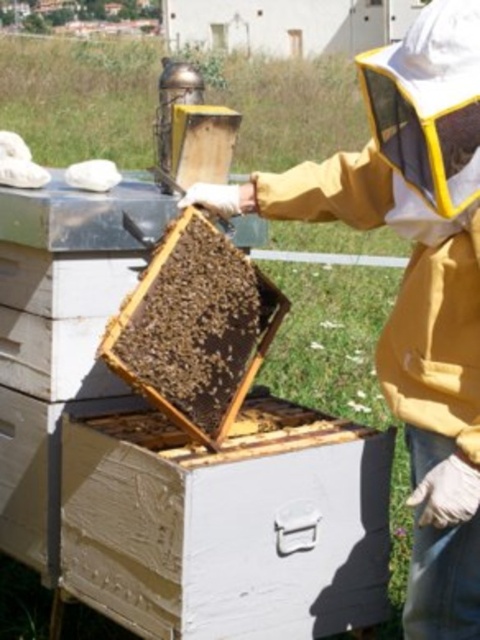
You are a beekeeper trying to determine if your yellow fabric beekeeper at center can be placed inside the beehive at center without any adjustments. Based on their sizes, is this possible?

The yellow fabric beekeeper at center is wider than the beehive at center, so it cannot be placed inside without adjustments.

You are a beekeeper trying to locate your tools. You see the yellow fabric beekeeper at center and the beehive at center. Which object is located to the right of the other?

The yellow fabric beekeeper at center is positioned on the right side of beehive at center.